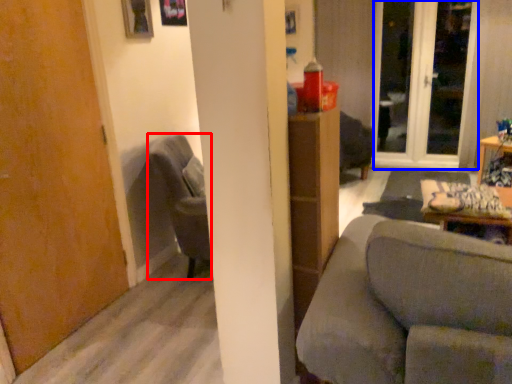
Question: Which object is further to the camera taking this photo, chair (highlighted by a red box) or screen door (highlighted by a blue box)?

Choices:
 (A) chair
 (B) screen door

Answer: (B)